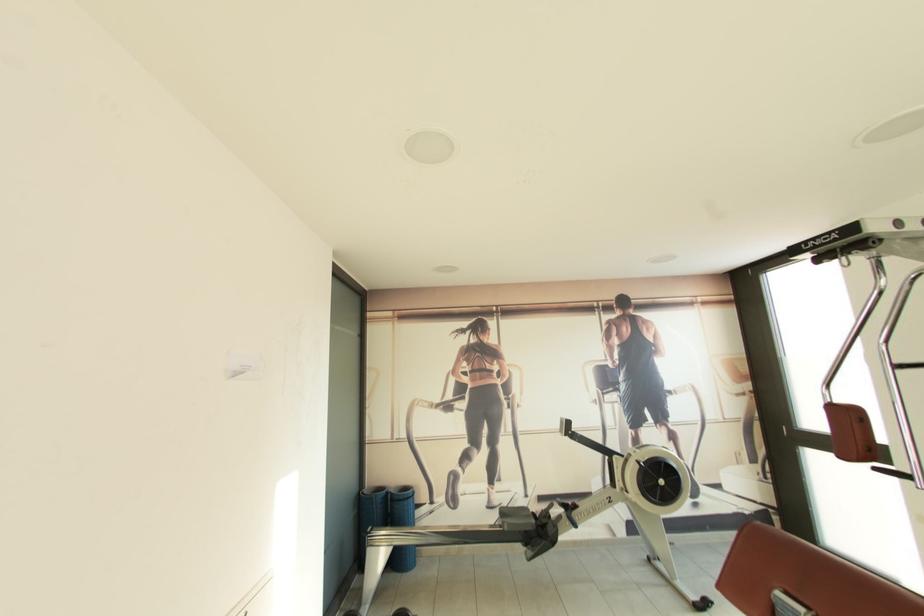
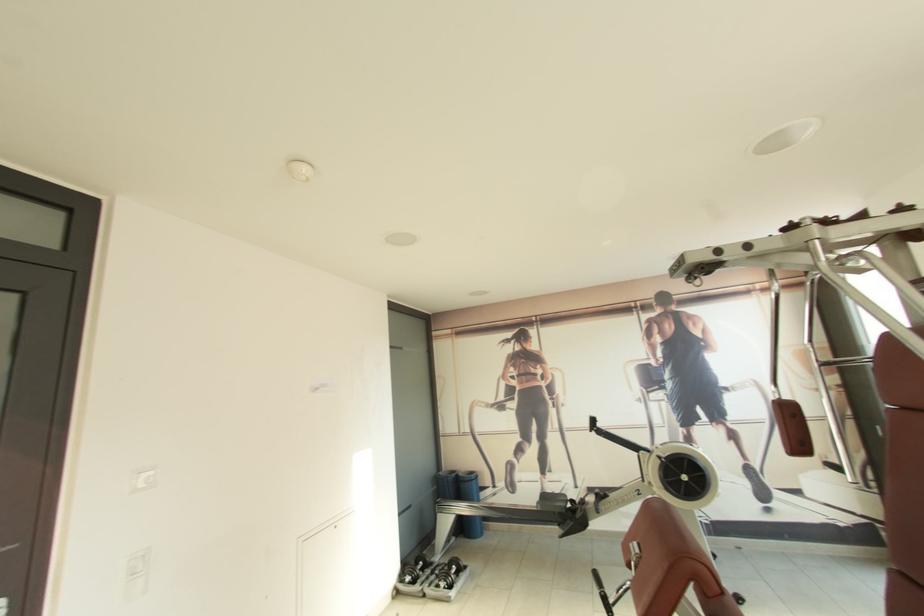
Locate, in the second image, the point that corresponds to the point at 411,445 in the first image.

(476, 438)